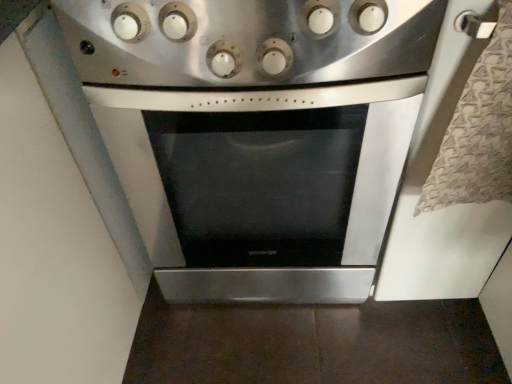
Question: Is satin silver knobs at upper center in front of or behind stainless steel oven at center in the image?

Choices:
 (A) front
 (B) behind

Answer: (A)

Question: From the image's perspective, is satin silver knobs at upper center located above or below stainless steel oven at center?

Choices:
 (A) below
 (B) above

Answer: (B)

Question: From a real-world perspective, is satin silver knobs at upper center physically located above or below stainless steel oven at center?

Choices:
 (A) below
 (B) above

Answer: (B)

Question: Looking at their shapes, would you say stainless steel oven at center is wider or thinner than satin silver knobs at upper center?

Choices:
 (A) wide
 (B) thin

Answer: (A)

Question: Considering the positions of point (204, 268) and point (204, 54), is point (204, 268) closer or farther from the camera than point (204, 54)?

Choices:
 (A) farther
 (B) closer

Answer: (A)

Question: Considering their positions, is stainless steel oven at center located in front of or behind satin silver knobs at upper center?

Choices:
 (A) behind
 (B) front

Answer: (A)

Question: Which is correct: stainless steel oven at center is inside satin silver knobs at upper center, or outside of it?

Choices:
 (A) inside
 (B) outside

Answer: (B)